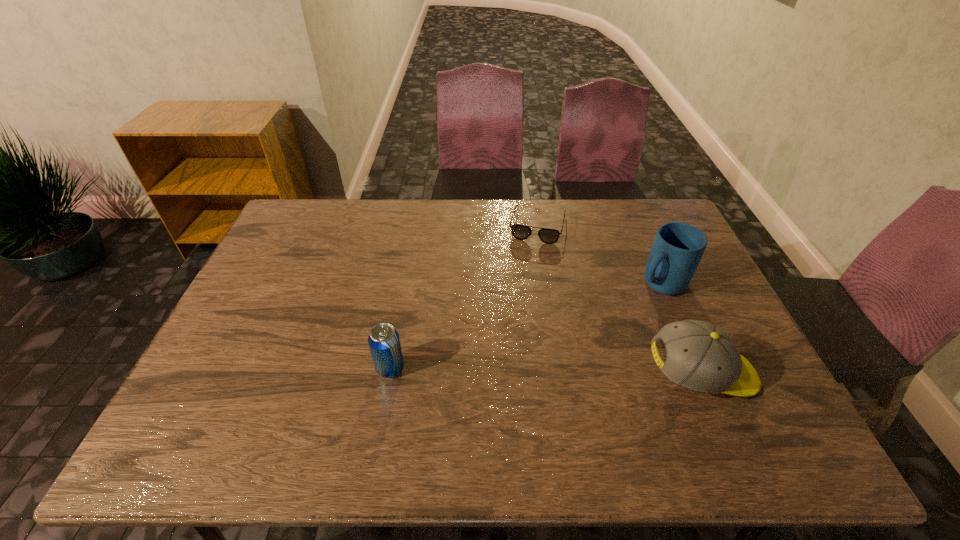
The image size is (960, 540). I want to click on beer can, so click(x=384, y=342).

This screenshot has width=960, height=540. What are the coordinates of `baseball cap` in the screenshot? It's located at click(x=701, y=357).

Image resolution: width=960 pixels, height=540 pixels. In order to click on the second farthest object in this screenshot , I will do `click(678, 247)`.

Where is `the second object from left to right`? This screenshot has width=960, height=540. the second object from left to right is located at coordinates (521, 232).

The width and height of the screenshot is (960, 540). Find the location of `the shortest object`. the shortest object is located at coordinates (521, 232).

Locate an element on the screen. This screenshot has width=960, height=540. free space located on the right of the beer can is located at coordinates (456, 368).

You are a GUI agent. You are given a task and a screenshot of the screen. Output one action in this format:
    pyautogui.click(x=<x>, y=<y>)
    Task: Click on the vacant region located 0.330m on the side of the mug with the handle
    This screenshot has height=540, width=960.
    Given the screenshot: What is the action you would take?
    pyautogui.click(x=564, y=351)

You are a GUI agent. You are given a task and a screenshot of the screen. Output one action in this format:
    pyautogui.click(x=<x>, y=<y>)
    Task: Click on the vacant area situated 0.350m on the side of the mug with the handle
    
    Given the screenshot: What is the action you would take?
    pyautogui.click(x=559, y=355)

You are a GUI agent. You are given a task and a screenshot of the screen. Output one action in this format:
    pyautogui.click(x=<x>, y=<y>)
    Task: Click on the vacant space situated on the side of the mug with the handle
    The image size is (960, 540).
    Given the screenshot: What is the action you would take?
    (x=553, y=359)

Find the location of a particular element. free location located 0.360m on the front-facing side of the second object from left to right is located at coordinates (515, 323).